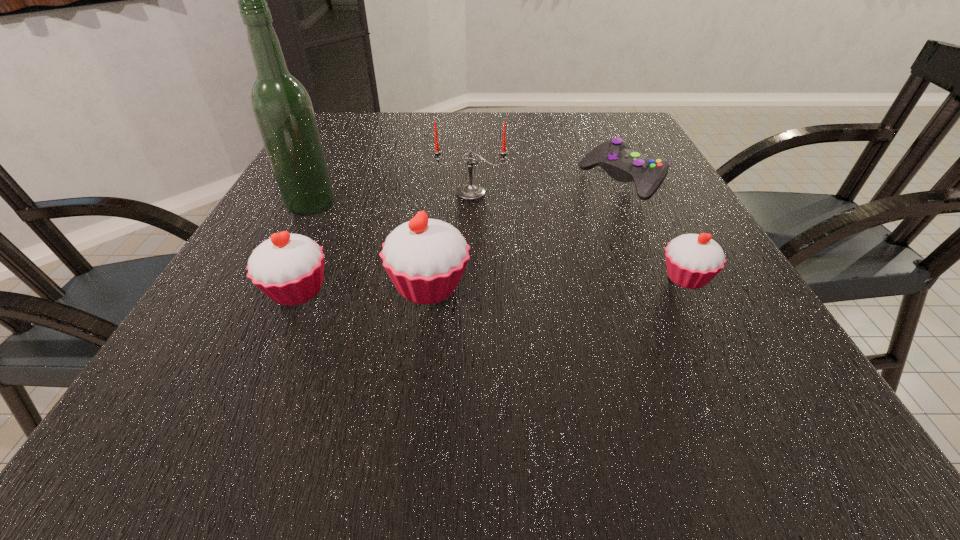
Locate an element on the screen. the second tallest cupcake is located at coordinates (289, 268).

Locate an element on the screen. Image resolution: width=960 pixels, height=540 pixels. the leftmost cupcake is located at coordinates (289, 268).

Find the location of a particular element. Image resolution: width=960 pixels, height=540 pixels. the tallest cupcake is located at coordinates (425, 258).

This screenshot has height=540, width=960. I want to click on the shortest cupcake, so click(692, 260).

The width and height of the screenshot is (960, 540). Find the location of `the second shortest object`. the second shortest object is located at coordinates (692, 260).

Locate an element on the screen. The image size is (960, 540). candle is located at coordinates (470, 191).

What are the coordinates of `the tallest object` in the screenshot? It's located at [282, 108].

Locate an element on the screen. the shortest object is located at coordinates (615, 156).

At what (x,y) coordinates should I click in order to perform the action: click on vacant space positioned on the right of the fourth tallest object. Please return your answer as a coordinate pair (x, y). This screenshot has width=960, height=540. Looking at the image, I should click on (529, 291).

This screenshot has height=540, width=960. In order to click on vacant space located 0.120m on the back of the second cupcake from right to left in this screenshot , I will do `click(437, 222)`.